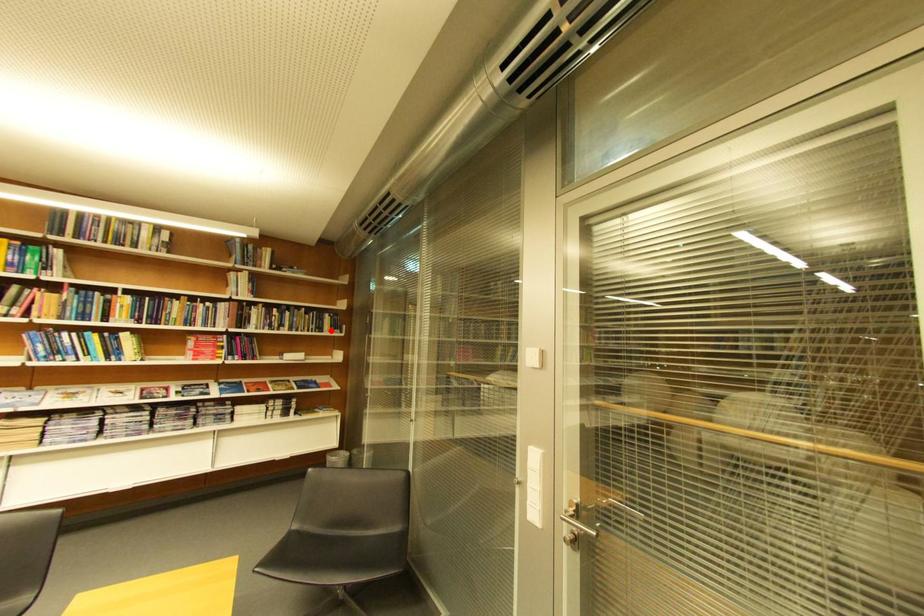
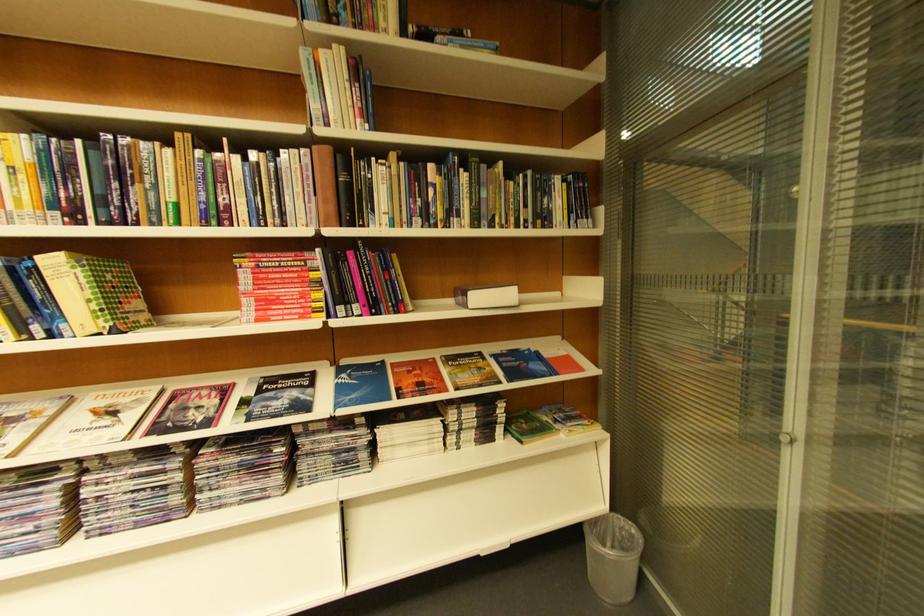
Where in the second image is the point corresponding to the highlighted location from the first image?

(554, 221)